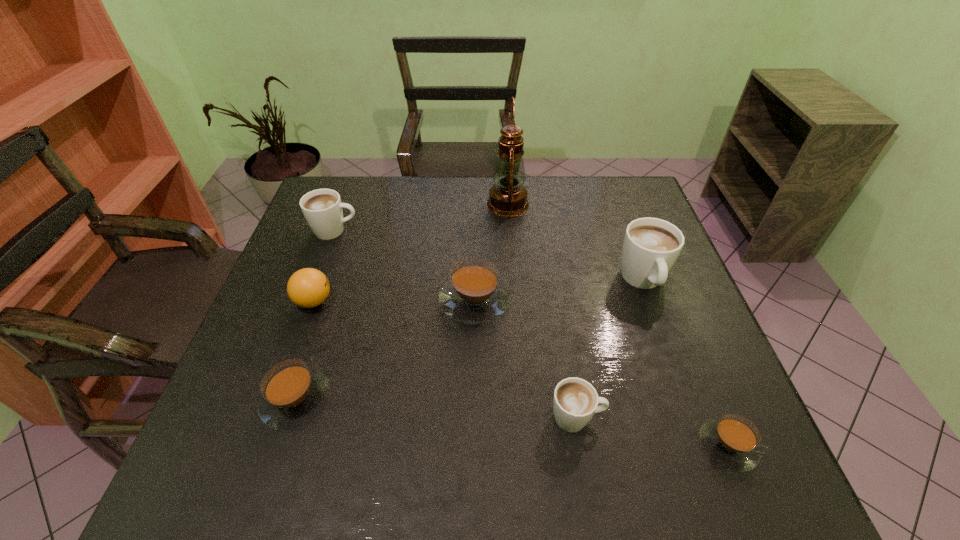
Identify the location of free point between the biggest white cappuccino and the tallest object. The image size is (960, 540). tap(575, 242).

At what (x,y) coordinates should I click in order to perform the action: click on empty space between the second biggest white cappuccino and the second smallest brown cappuccino. Please return your answer as a coordinate pair (x, y). Looking at the image, I should click on (316, 315).

Where is `free space that is in between the oil lamp and the rightmost white cappuccino`? Image resolution: width=960 pixels, height=540 pixels. free space that is in between the oil lamp and the rightmost white cappuccino is located at coordinates (575, 242).

Select which object appears as the fourth closest to the farthest cappuccino. Please provide its 2D coordinates. Your answer should be formatted as a tuple, i.e. [(x, y)], where the tuple contains the x and y coordinates of a point satisfying the conditions above.

[(293, 394)]

The width and height of the screenshot is (960, 540). Identify the location of object that is the sixth closest to the second white cappuccino from left to right. (508, 196).

You are a GUI agent. You are given a task and a screenshot of the screen. Output one action in this format:
    pyautogui.click(x=<x>, y=<y>)
    Task: Click on the cappuccino that stands as the second closest to the tallest cappuccino
    
    Given the screenshot: What is the action you would take?
    pyautogui.click(x=474, y=294)

Locate which cappuccino is the sixth closest to the ping-pong ball. Please provide its 2D coordinates. Your answer should be formatted as a tuple, i.e. [(x, y)], where the tuple contains the x and y coordinates of a point satisfying the conditions above.

[(732, 441)]

At what (x,y) coordinates should I click in order to perform the action: click on white cappuccino that is the second closest to the second smallest white cappuccino. Please return your answer as a coordinate pair (x, y). The width and height of the screenshot is (960, 540). Looking at the image, I should click on (651, 246).

Identify the location of white cappuccino that stands as the closest to the tallest object. The image size is (960, 540). (651, 246).

Locate an element on the screen. the closest brown cappuccino to the leftmost brown cappuccino is located at coordinates (474, 294).